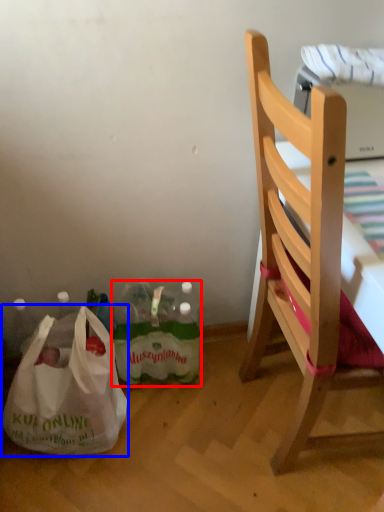
Question: Which point is closer to the camera, bottle (highlighted by a red box) or plastic bag (highlighted by a blue box)?

Choices:
 (A) bottle
 (B) plastic bag

Answer: (B)